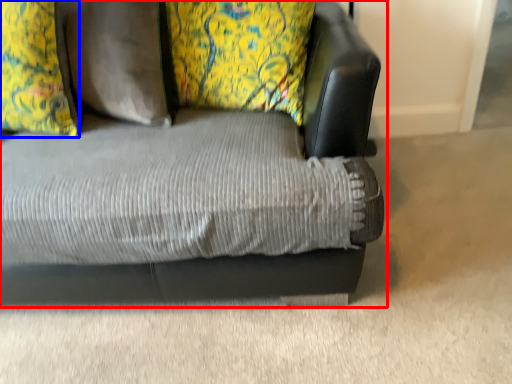
Question: Which of the following is the farthest to the observer, studio couch (highlighted by a red box) or pillow (highlighted by a blue box)?

Choices:
 (A) studio couch
 (B) pillow

Answer: (B)